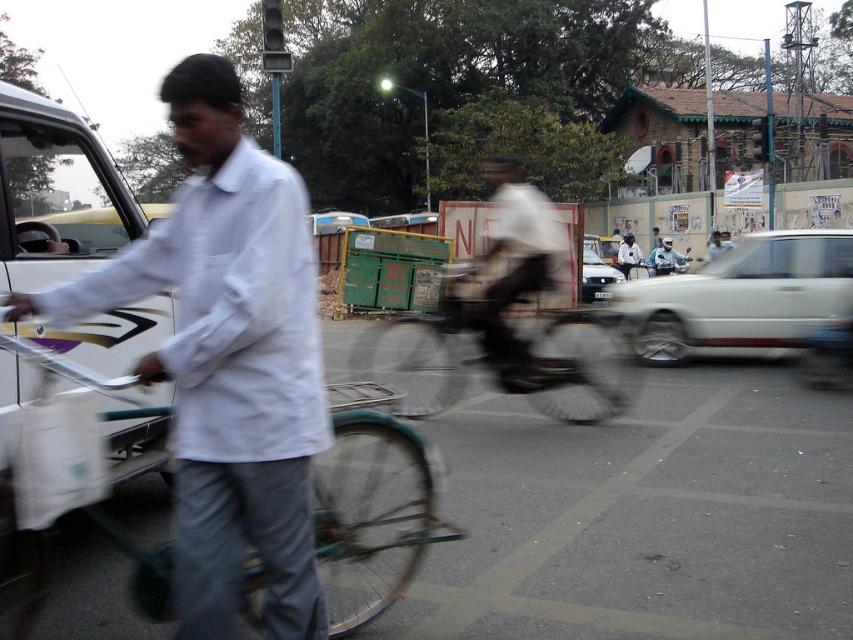
Question: Which point is farther to the camera?

Choices:
 (A) (653, 273)
 (B) (631, 244)
 (C) (605, 412)
 (D) (531, 372)

Answer: (B)

Question: Does dark gray fabric bicycle at center appear over matte white car at center?

Choices:
 (A) no
 (B) yes

Answer: (B)

Question: Is white glossy car at right closer to camera compared to matte white car at center?

Choices:
 (A) no
 (B) yes

Answer: (B)

Question: In this image, where is white glossy car at right located relative to white cotton shirt at center?

Choices:
 (A) left
 (B) right

Answer: (A)

Question: Estimate the real-world distances between objects in this image. Which object is closer to the white glossy car at right?

Choices:
 (A) white cotton shirt at center
 (B) dark gray fabric bicycle at center

Answer: (B)

Question: Which of the following is the closest to the observer?

Choices:
 (A) click(x=363, y=339)
 (B) click(x=50, y=305)
 (C) click(x=585, y=280)

Answer: (B)